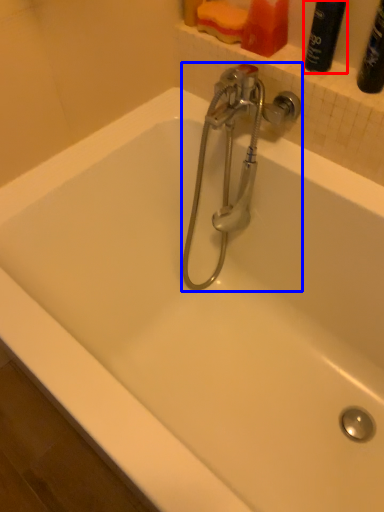
Question: Which point is further to the camera, cleaning product (highlighted by a red box) or tap (highlighted by a blue box)?

Choices:
 (A) cleaning product
 (B) tap

Answer: (B)